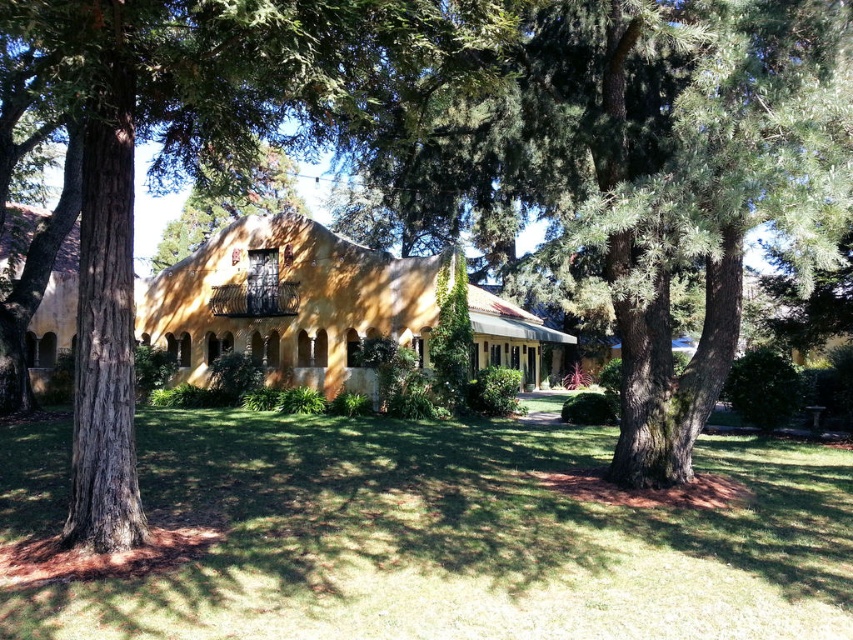
Is green textured tree at center smaller than brown textured tree at center?

No, green textured tree at center is not smaller than brown textured tree at center.

In order to click on green textured tree at center in this screenshot , I will do `click(653, 173)`.

You are a GUI agent. You are given a task and a screenshot of the screen. Output one action in this format:
    pyautogui.click(x=<x>, y=<y>)
    Task: Click on the green textured tree at center
    The image size is (853, 640).
    Given the screenshot: What is the action you would take?
    pyautogui.click(x=653, y=173)

Does green grass at center appear on the right side of green textured tree at center?

Incorrect, green grass at center is not on the right side of green textured tree at center.

Which is more to the right, green grass at center or green textured tree at center?

green textured tree at center

Does point (50, 432) lie in front of point (509, 54)?

No, it is not.

At what (x,y) coordinates should I click in order to perform the action: click on green grass at center. Please return your answer as a coordinate pair (x, y). The width and height of the screenshot is (853, 640). Looking at the image, I should click on (459, 538).

Can you confirm if green grass at center is positioned above brown textured tree at center?

No.

Is green grass at center thinner than brown textured tree at center?

No, green grass at center is not thinner than brown textured tree at center.

Between point (848, 452) and point (80, 262), which one is positioned behind?

Positioned behind is point (848, 452).

At what (x,y) coordinates should I click in order to perform the action: click on green grass at center. Please return your answer as a coordinate pair (x, y). Looking at the image, I should click on (459, 538).